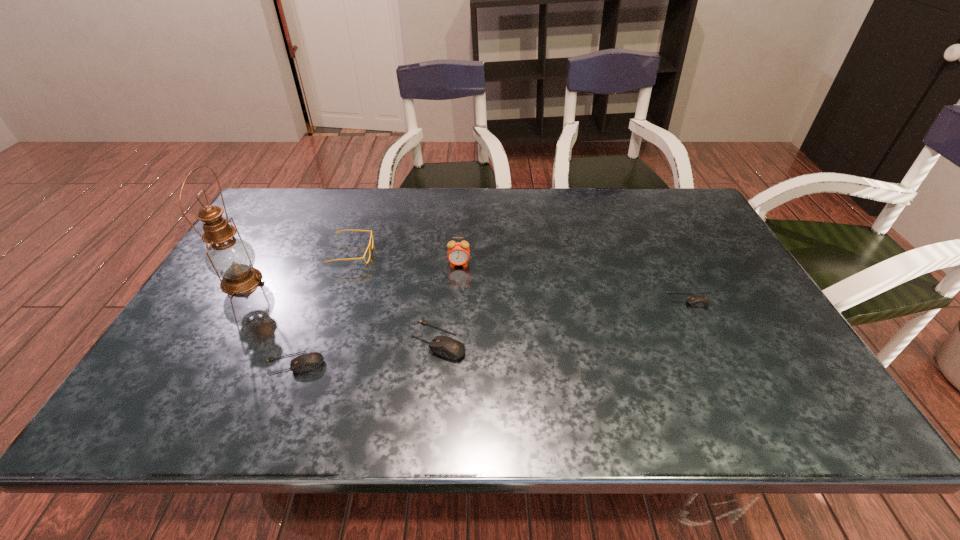
This screenshot has width=960, height=540. Identify the location of the fifth tallest object. (306, 362).

Find the location of a particular element. The height and width of the screenshot is (540, 960). the second shortest mouse is located at coordinates (306, 362).

Identify the location of the tallest mouse. The height and width of the screenshot is (540, 960). (444, 346).

Locate an element on the screen. Image resolution: width=960 pixels, height=540 pixels. the fourth tallest object is located at coordinates (444, 346).

I want to click on the rightmost mouse, so [x=694, y=300].

You are a GUI agent. You are given a task and a screenshot of the screen. Output one action in this format:
    pyautogui.click(x=<x>, y=<y>)
    Task: Click on the farthest mouse
    
    Given the screenshot: What is the action you would take?
    pyautogui.click(x=694, y=300)

You are a GUI agent. You are given a task and a screenshot of the screen. Output one action in this format:
    pyautogui.click(x=<x>, y=<y>)
    Task: Click on the third tallest object
    The width and height of the screenshot is (960, 540).
    Given the screenshot: What is the action you would take?
    pyautogui.click(x=369, y=246)

Locate an element on the screen. The height and width of the screenshot is (540, 960). the tallest object is located at coordinates (232, 259).

Where is `oil lamp`? The image size is (960, 540). oil lamp is located at coordinates (232, 259).

This screenshot has height=540, width=960. Identify the location of the fifth shortest object. (458, 254).